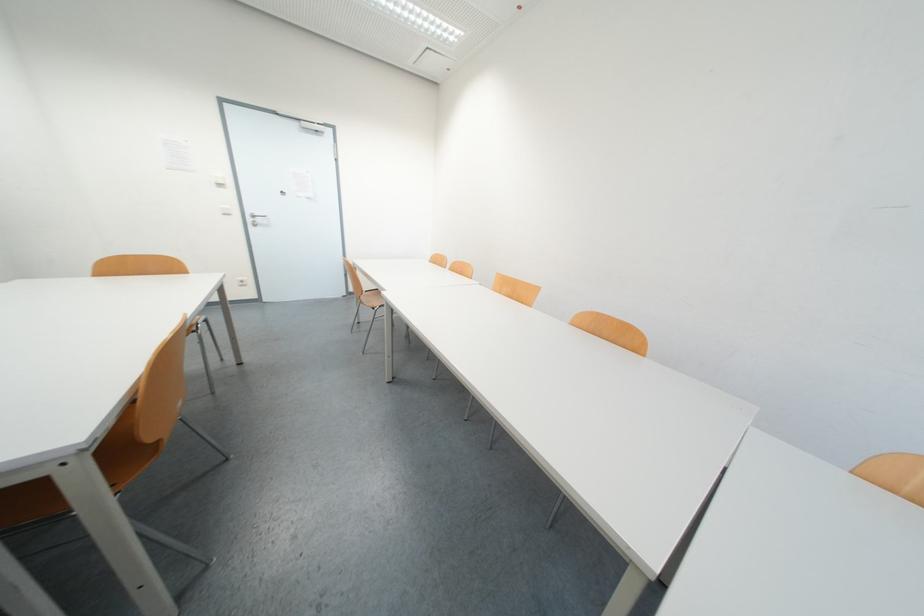
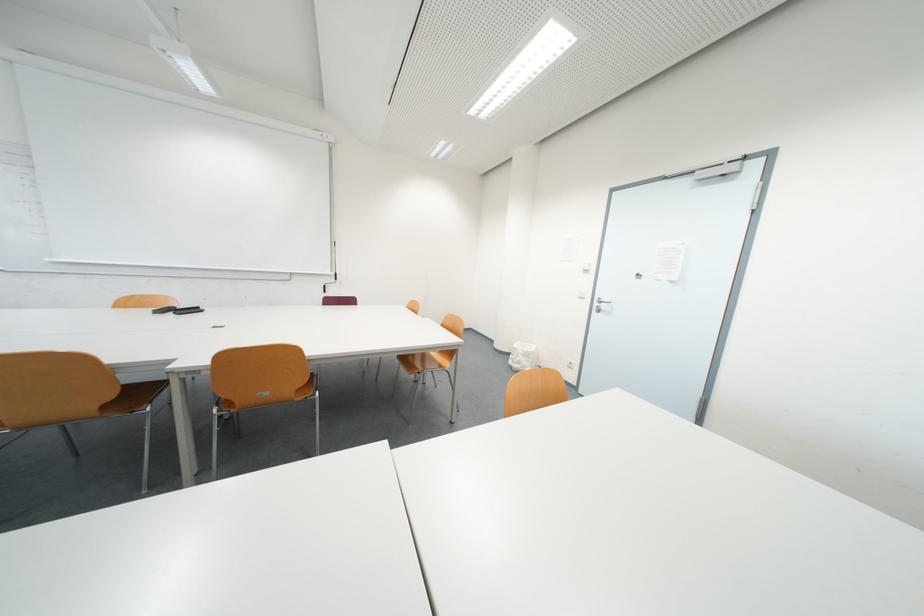
Locate, in the second image, the point that corresponds to (260,220) in the first image.

(605, 305)